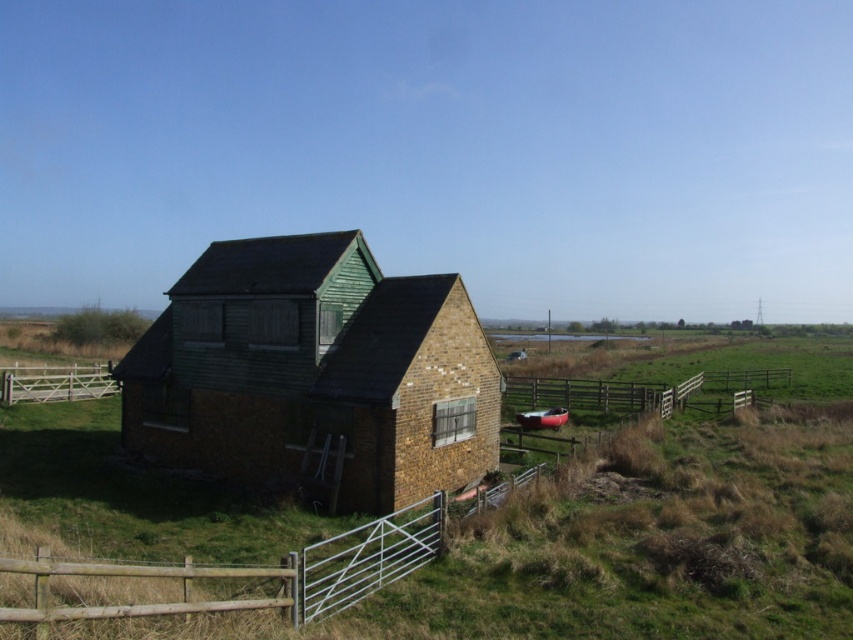
Is point (344, 244) more distant than point (372, 544)?

Yes, point (344, 244) is behind point (372, 544).

Does green wooden hut at center lie behind wooden at lower left?

Yes, it is behind wooden at lower left.

Locate an element on the screen. This screenshot has height=640, width=853. green wooden hut at center is located at coordinates (315, 372).

Find the location of `green wooden hut at center`. green wooden hut at center is located at coordinates (315, 372).

Does point (704, 372) come closer to viewer compared to point (99, 376)?

No, (704, 372) is further to viewer.

Can you confirm if wooden fence at lower right is wider than white wooden gate at left?

Yes, wooden fence at lower right is wider than white wooden gate at left.

Is point (589, 381) more distant than point (53, 368)?

Yes, it is.

The height and width of the screenshot is (640, 853). Identify the location of wooden fence at lower right. (637, 392).

Is point (376, 525) closer to viewer compared to point (759, 369)?

Yes, it is.

Between point (375, 582) and point (618, 404), which one is positioned in front?

Positioned in front is point (375, 582).

The image size is (853, 640). In order to click on wooden at lower left in this screenshot , I will do `click(260, 572)`.